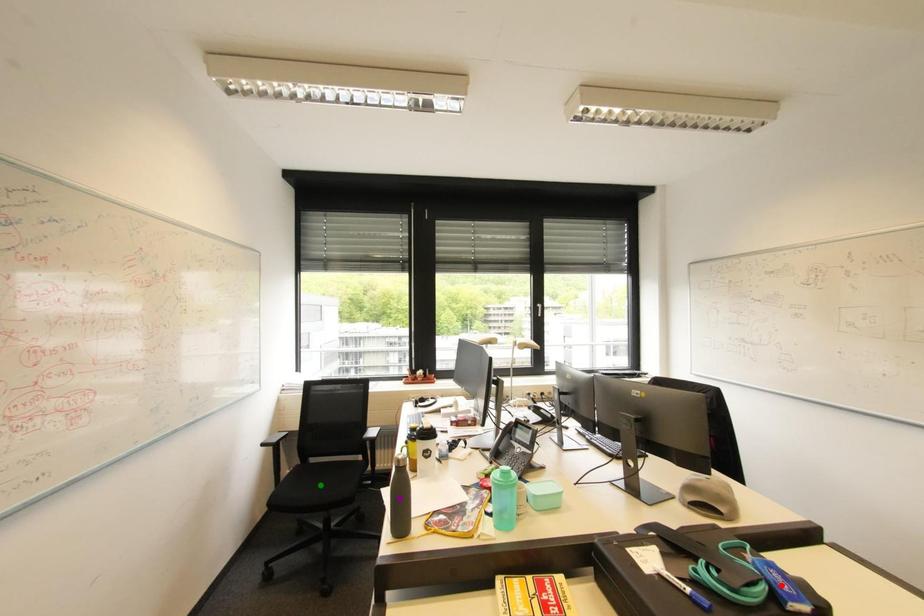
Order these from farthest to nearest:
A) green point
B) red point
C) purple point

1. green point
2. purple point
3. red point